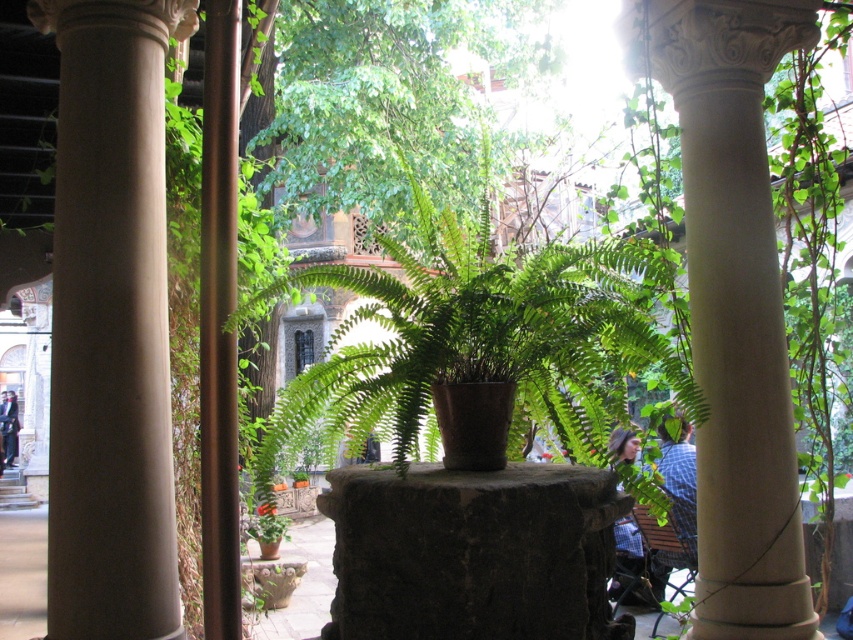
You are standing in the courtyard and want to take a photo of the smooth beige column at left. Where should you position yourself to ensure it is centered in your camera frame?

To center the smooth beige column at left in your camera frame, position yourself directly in front of it at its coordinates point [109,323].

You are standing in the courtyard and want to touch both the smooth beige column at left and the white stone column at center. Which column should you approach first to reach the closer one?

You should approach the smooth beige column at left first because it is closer to you than the white stone column at center.

Consider the image. You are an architect analyzing the courtyard layout. You need to determine which column, the smooth beige column at left or the white stone column at center, is shorter in height. Which one is shorter?

The smooth beige column at left is not as tall as the white stone column at center, so the smooth beige column at left is shorter in height.